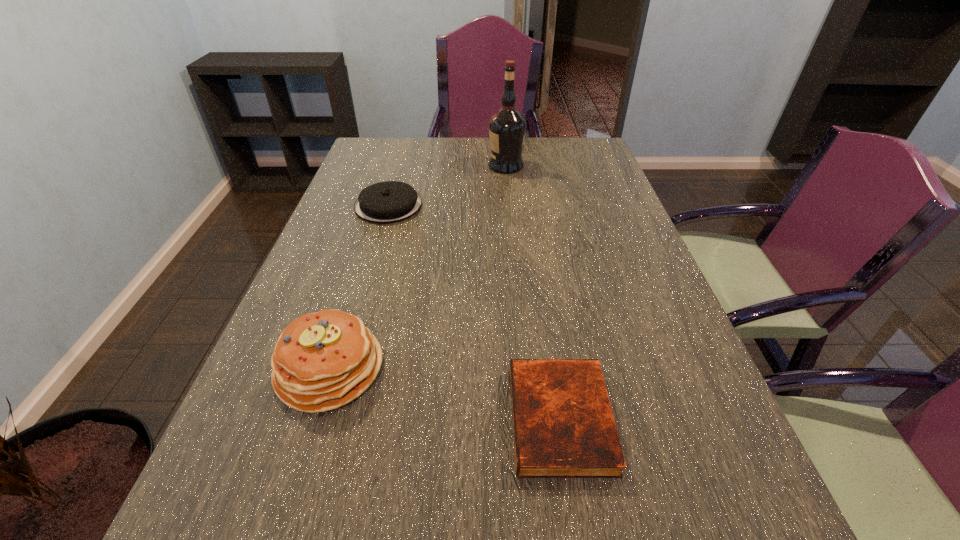
At what (x,y) coordinates should I click in order to perform the action: click on liquor. Please return your answer as a coordinate pair (x, y). Looking at the image, I should click on (507, 127).

The height and width of the screenshot is (540, 960). Identify the location of the tallest object. (507, 127).

You are a GUI agent. You are given a task and a screenshot of the screen. Output one action in this format:
    pyautogui.click(x=<x>, y=<y>)
    Task: Click on the nearer pancake
    The width and height of the screenshot is (960, 540).
    Given the screenshot: What is the action you would take?
    pyautogui.click(x=324, y=360)

Identify the location of the taller pancake. (324, 360).

You are a GUI agent. You are given a task and a screenshot of the screen. Output one action in this format:
    pyautogui.click(x=<x>, y=<y>)
    Task: Click on the shorter pancake
    The image size is (960, 540).
    Given the screenshot: What is the action you would take?
    pyautogui.click(x=386, y=202)

Locate an element on the screen. the third tallest object is located at coordinates (386, 202).

Locate an element on the screen. Image resolution: width=960 pixels, height=540 pixels. the shortest object is located at coordinates (563, 425).

Locate an element on the screen. The width and height of the screenshot is (960, 540). vacant space located 0.310m on the surface of the farthest object is located at coordinates (398, 166).

Locate an element on the screen. Image resolution: width=960 pixels, height=540 pixels. free location located 0.310m on the surface of the farthest object is located at coordinates (398, 166).

Find the location of `free space located on the surface of the farthest object`. free space located on the surface of the farthest object is located at coordinates (393, 166).